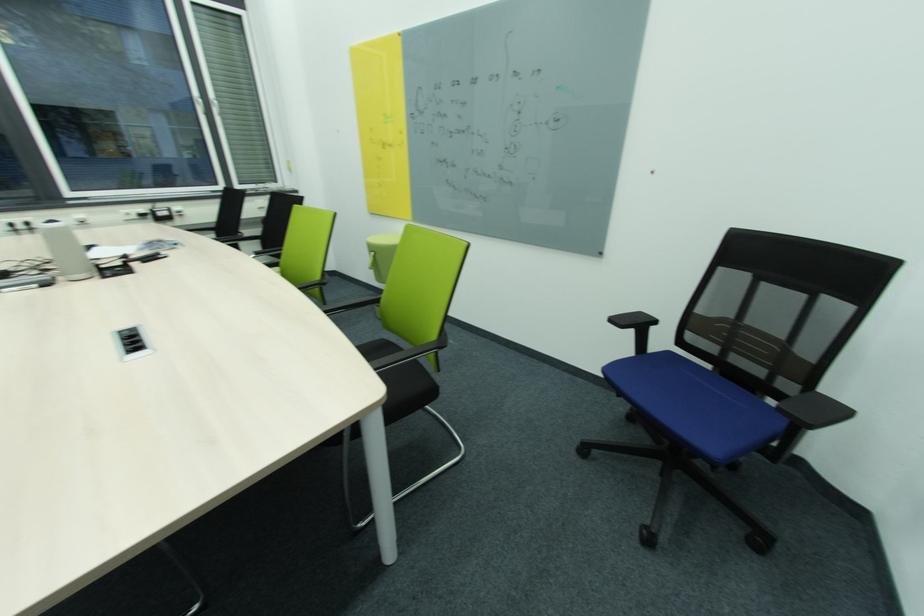
Find the location of a particular element. The height and width of the screenshot is (616, 924). metal chair armrest is located at coordinates (400, 352).